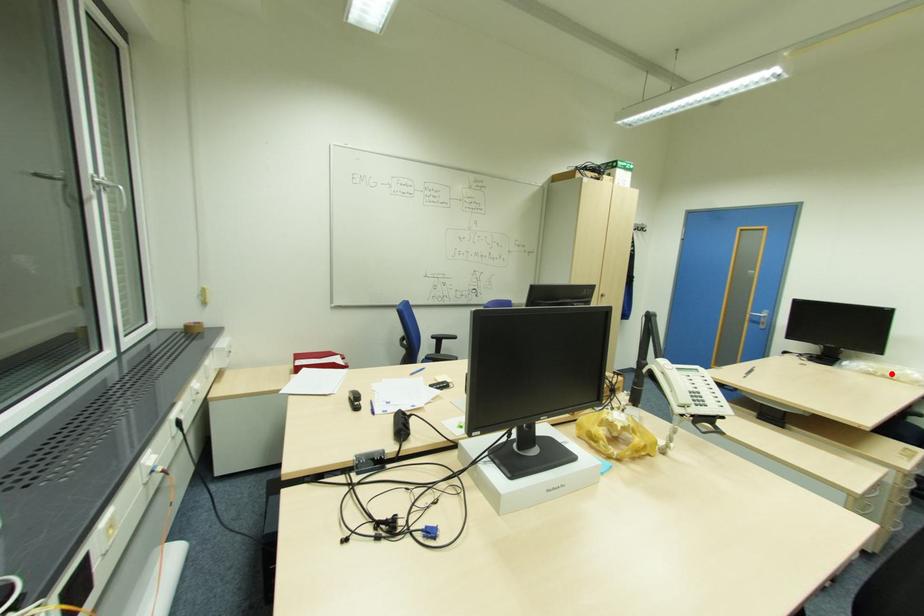
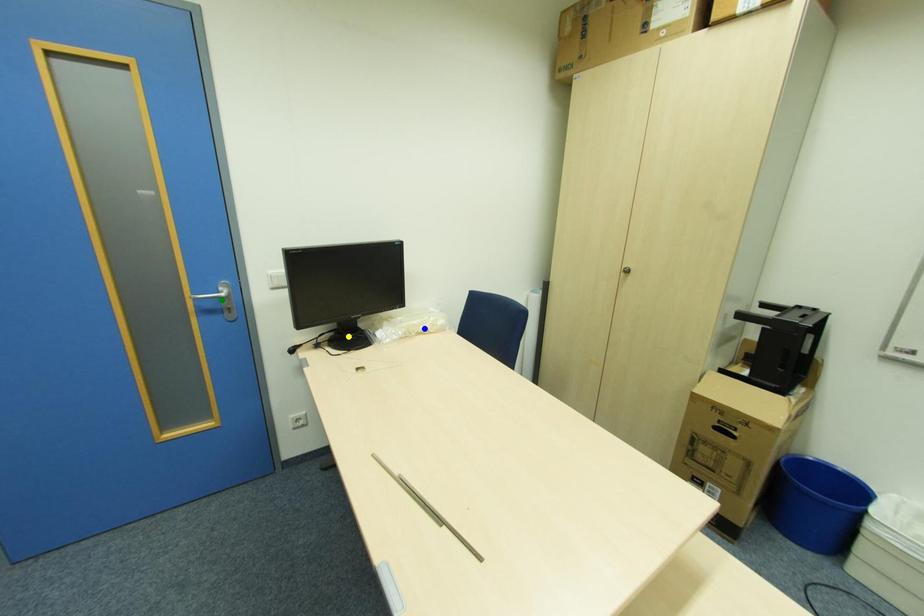
Question: I am providing you with two images of the same scene from different viewpoints. A red point is marked on the first image. You are given multiple points on the second image. Which mark in image 2 goes with the point in image 1?

Choices:
 (A) green point
 (B) blue point
 (C) yellow point

Answer: (B)